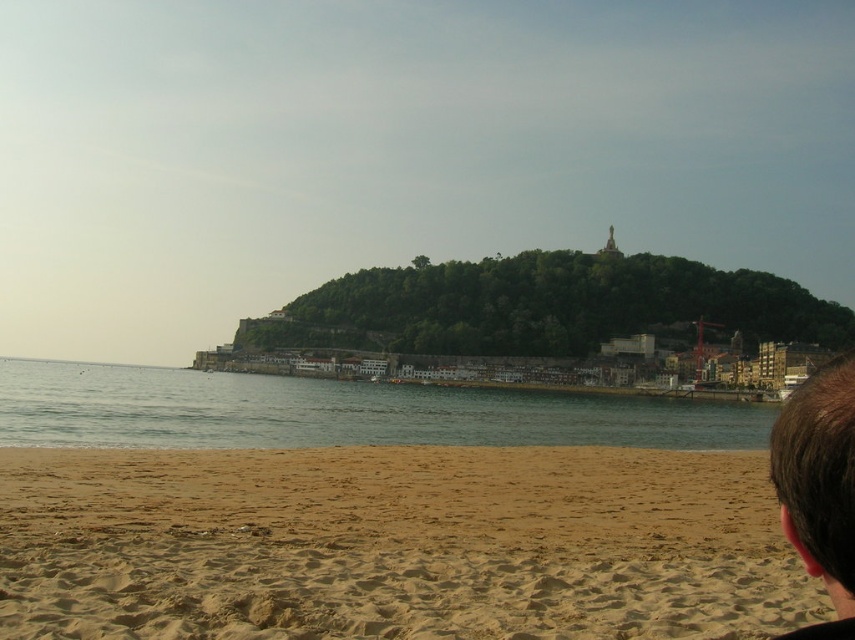
Between point (220, 470) and point (118, 376), which one is positioned in front?

Point (220, 470)

Does fine-grained sand at lower left have a lesser width compared to clear water at lower center?

Correct, fine-grained sand at lower left's width is less than clear water at lower center's.

Is point (623, 573) positioned before point (641, 444)?

Yes.

I want to click on fine-grained sand at lower left, so [394, 545].

Can you confirm if fine-grained sand at lower left is positioned to the left of brown hair at lower right?

Indeed, fine-grained sand at lower left is positioned on the left side of brown hair at lower right.

Does fine-grained sand at lower left lie behind brown hair at lower right?

Yes, it is behind brown hair at lower right.

The height and width of the screenshot is (640, 855). What are the coordinates of `fine-grained sand at lower left` in the screenshot? It's located at [394, 545].

Consider the image. Between clear water at lower center and brown hair at lower right, which one appears on the right side from the viewer's perspective?

Positioned to the right is brown hair at lower right.

Does clear water at lower center appear on the left side of brown hair at lower right?

Indeed, clear water at lower center is positioned on the left side of brown hair at lower right.

Is point (45, 440) closer to viewer compared to point (826, 541)?

No, it is not.

Where is `clear water at lower center`? clear water at lower center is located at coordinates (339, 412).